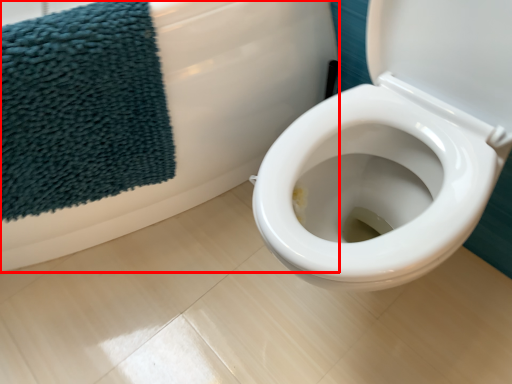
Question: From the image's perspective, what is the correct spatial positioning of bath (annotated by the red box) in reference to beach towel?

Choices:
 (A) below
 (B) above

Answer: (B)